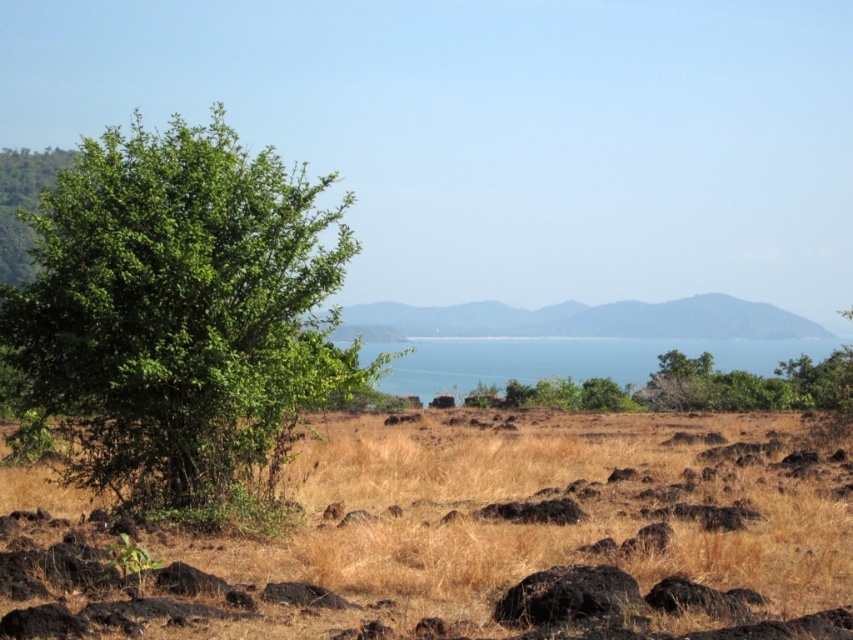
Question: Is brown dry grass at center smaller than green leafy tree at left?

Choices:
 (A) no
 (B) yes

Answer: (B)

Question: Among these objects, which one is farthest from the camera?

Choices:
 (A) brown dry grass at center
 (B) green leafy tree at left

Answer: (B)

Question: Is brown dry grass at center closer to camera compared to green leafy tree at left?

Choices:
 (A) yes
 (B) no

Answer: (A)

Question: Is brown dry grass at center to the left of green leafy tree at left from the viewer's perspective?

Choices:
 (A) yes
 (B) no

Answer: (B)

Question: Which of the following is the closest to the observer?

Choices:
 (A) (561, 584)
 (B) (241, 420)

Answer: (A)